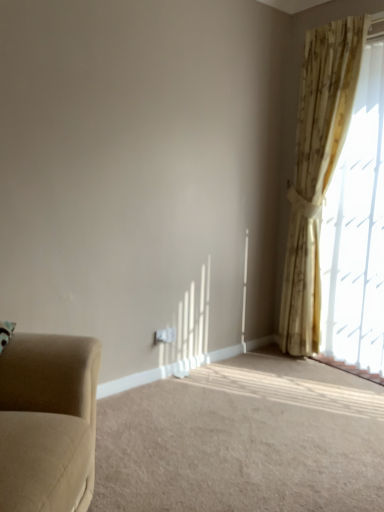
Question: In terms of size, does beige floral curtain at upper right appear bigger or smaller than suede-like beige armchair at lower left?

Choices:
 (A) small
 (B) big

Answer: (B)

Question: Is beige floral curtain at upper right to the left or to the right of suede-like beige armchair at lower left in the image?

Choices:
 (A) right
 (B) left

Answer: (A)

Question: Based on their relative distances, which object is nearer to the beige floral curtain at upper right?

Choices:
 (A) suede-like beige armchair at lower left
 (B) beige fabric studio couch at left

Answer: (A)

Question: Estimate the real-world distances between objects in this image. Which object is farther from the suede-like beige armchair at lower left?

Choices:
 (A) beige fabric studio couch at left
 (B) beige floral curtain at upper right

Answer: (B)